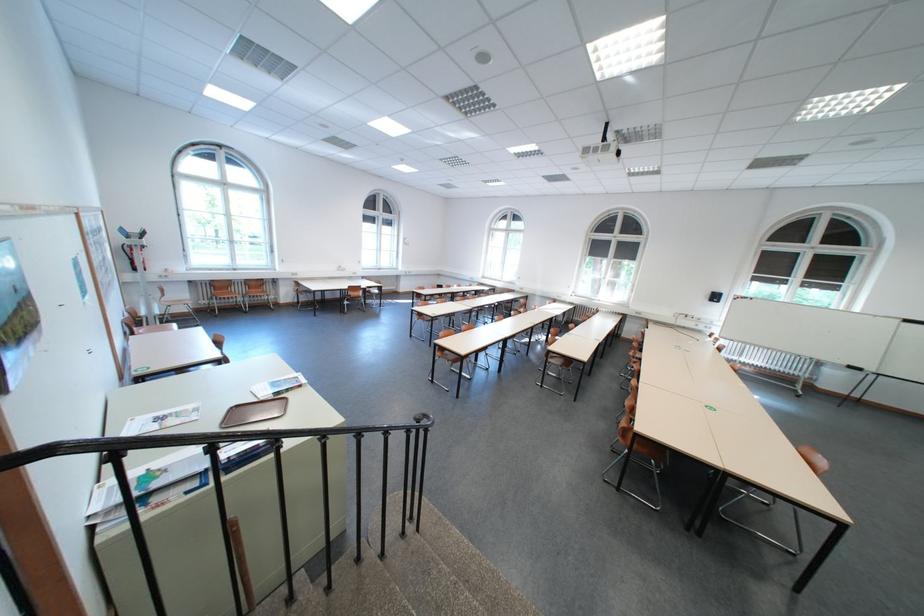
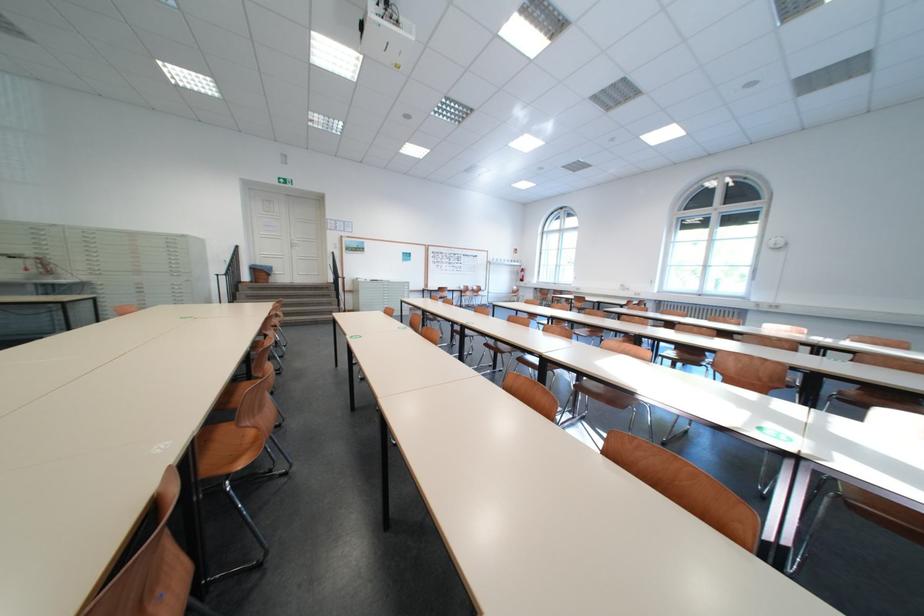
Question: I am providing you with two images of the same scene from different viewpoints. Please identify which objects are invisible in image2.

Choices:
 (A) wooden chair handle
 (B) black stair railing
 (C) white door handle
 (D) brown chair surface

Answer: (B)